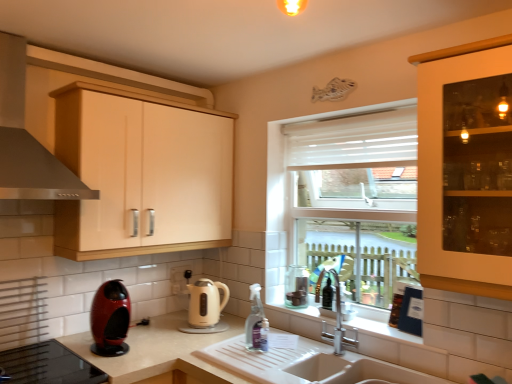
This screenshot has width=512, height=384. I want to click on free space in front of beige glossy electric kettle at center, so click(186, 337).